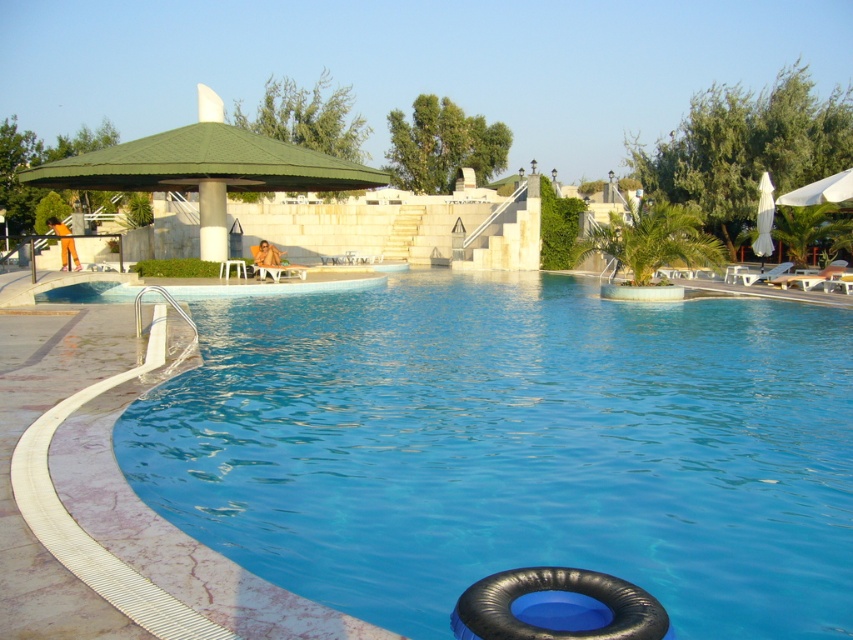
You are standing at the edge of the pool and want to reach the point marked at coordinates (480,394). Based on the distance provided, can you safely walk to that point without entering the water?

The point at coordinates (480,394) is 9.38 meters away from the viewer. Since the pool has a shallow end leading into deeper waters, you can walk to that point as long as it remains within the shallow area. However, without knowing the exact depth at that specific coordinate, it is recommended to check the depth before proceeding.

You are a swimmer who wants to choose a ring to float on. The blue rubber ring at lower center and the black rubber ring at lower center are both available. Which one has a larger size?

The blue rubber ring at lower center is bigger than the black rubber ring at lower center, so the blue one has a larger size.

You are a guest at this poolside area and want to place your towel under the white fabric umbrella at right. However, there is a black rubber ring at lower center in the way. Can you move the ring to the right to make space?

The black rubber ring at lower center is already positioned on the left side of the white fabric umbrella at right, so moving it further to the right would place it even closer to the umbrella, potentially blocking access. Consider moving it to the left instead to create more space.